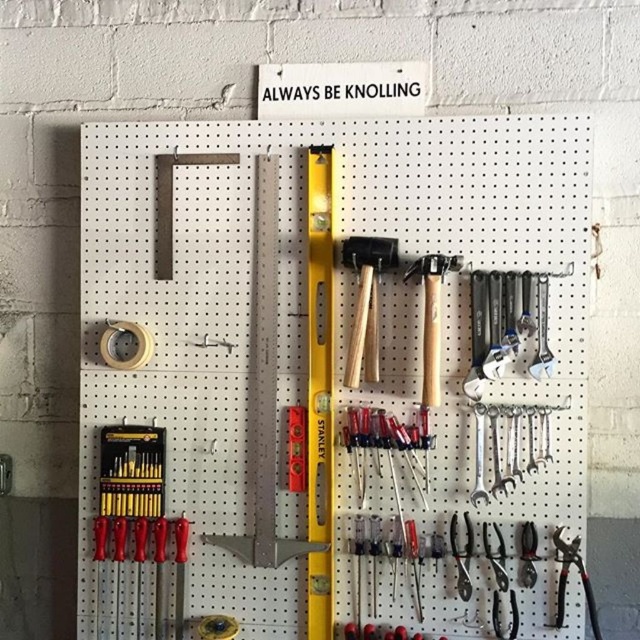
Between point (179, 577) and point (496, 422), which one is positioned in front?

Point (496, 422)

Which is more to the right, matte black screwdriver set at lower left or polished chrome wrenches at center right?

polished chrome wrenches at center right

Is point (177, 541) in front of point (547, 436)?

No, it is not.

Where is `matte black screwdriver set at lower left`? matte black screwdriver set at lower left is located at coordinates (140, 515).

Which is more to the left, white pegboard at center or matte black screwdriver set at lower left?

From the viewer's perspective, matte black screwdriver set at lower left appears more on the left side.

Does white pegboard at center have a lesser height compared to matte black screwdriver set at lower left?

No, white pegboard at center is not shorter than matte black screwdriver set at lower left.

Between point (392, 131) and point (141, 499), which one is positioned in front?

Point (392, 131)

Where is `white pegboard at center`? white pegboard at center is located at coordinates (332, 369).

Between white pegboard at center and wooden mallets at center, which one appears on the right side from the viewer's perspective?

wooden mallets at center is more to the right.

The height and width of the screenshot is (640, 640). Find the location of `white pegboard at center`. white pegboard at center is located at coordinates (332, 369).

Find the location of a particular element. The image size is (640, 640). white pegboard at center is located at coordinates (332, 369).